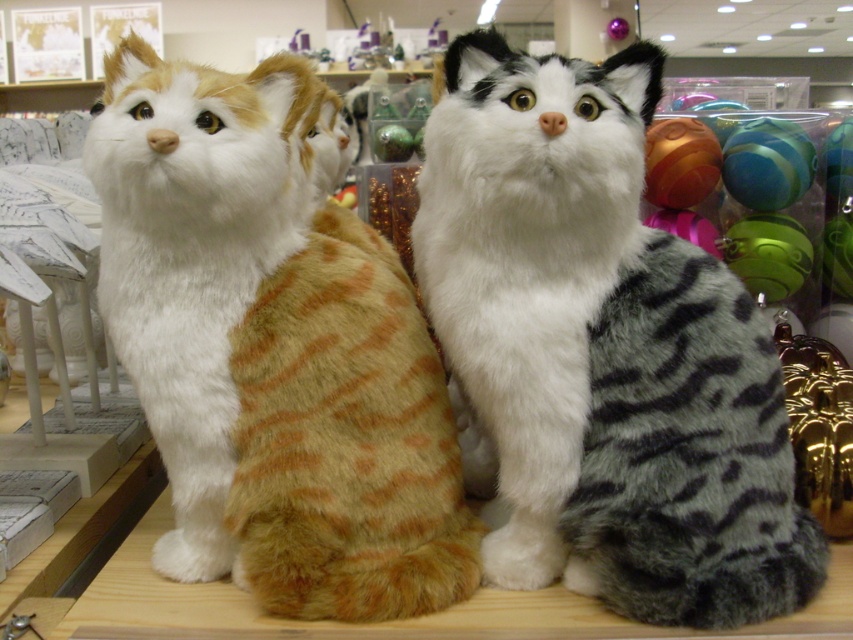
Is white fur cat at center positioned behind orange-brown striped plush cat at left?

Yes, it is.

Is point (722, 502) farther from viewer compared to point (318, 456)?

No, (722, 502) is closer to viewer.

In order to click on white fur cat at center in this screenshot , I will do `click(601, 353)`.